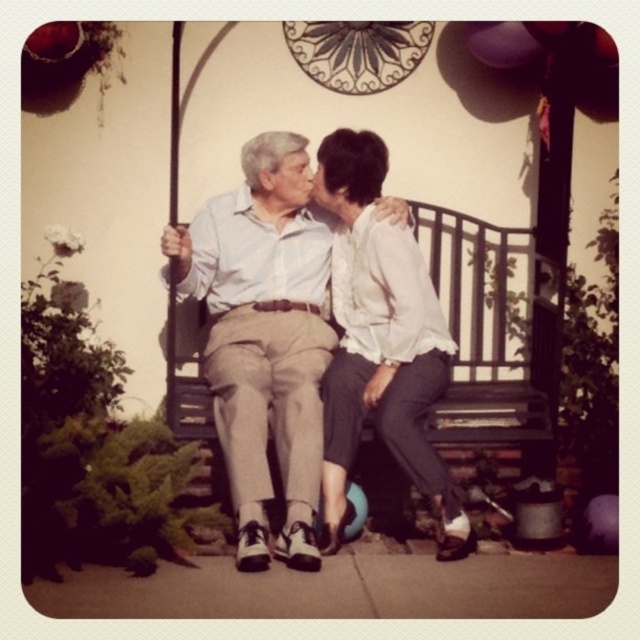
Question: Is light beige cotton pants at center to the left of white satin blouse at upper right from the viewer's perspective?

Choices:
 (A) yes
 (B) no

Answer: (A)

Question: Can you confirm if light beige cotton pants at center is wider than white satin blouse at upper right?

Choices:
 (A) no
 (B) yes

Answer: (B)

Question: Which point is closer to the camera?

Choices:
 (A) (184, 280)
 (B) (426, 474)

Answer: (B)

Question: Which object appears closest to the camera in this image?

Choices:
 (A) light beige cotton pants at center
 (B) white satin blouse at upper right

Answer: (A)

Question: Which point is farther to the camera?

Choices:
 (A) light beige cotton pants at center
 (B) white satin blouse at upper right

Answer: (B)

Question: Does light beige cotton pants at center have a lesser width compared to white satin blouse at upper right?

Choices:
 (A) yes
 (B) no

Answer: (B)